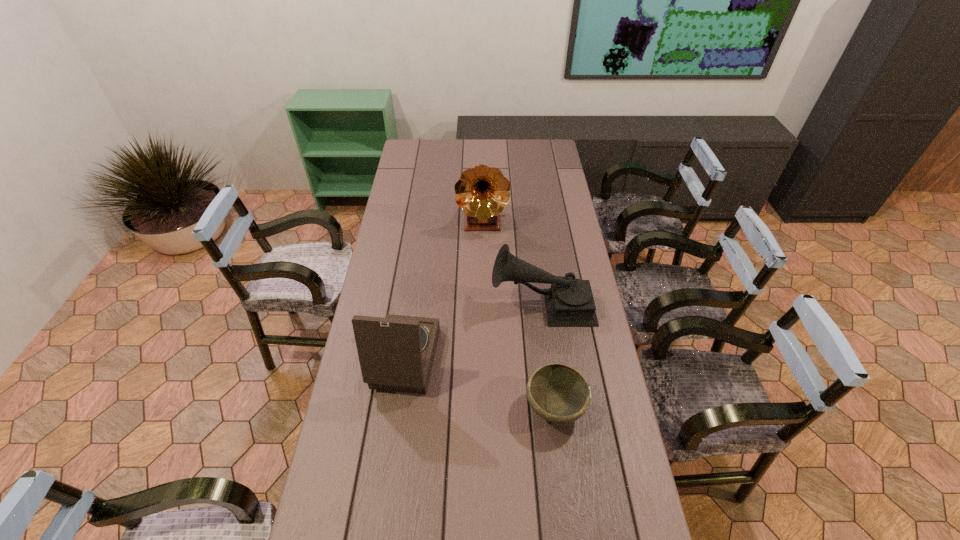
You are a GUI agent. You are given a task and a screenshot of the screen. Output one action in this format:
    pyautogui.click(x=<x>, y=<y>)
    Task: Click on the object positioned at the left edge
    This screenshot has height=540, width=960.
    Given the screenshot: What is the action you would take?
    pyautogui.click(x=396, y=353)

Find the location of a particular element. The image size is (960, 540). phonograph_record present at the right edge is located at coordinates (569, 302).

Where is `bowl positioned at the right edge`? This screenshot has width=960, height=540. bowl positioned at the right edge is located at coordinates (558, 393).

At what (x,y) coordinates should I click in order to perform the action: click on vacant position at the far edge of the desktop. Please return your answer as a coordinate pair (x, y). The height and width of the screenshot is (540, 960). Looking at the image, I should click on (502, 163).

The height and width of the screenshot is (540, 960). What are the coordinates of `vacant space at the left edge of the desktop` in the screenshot? It's located at (406, 211).

Find the location of a particular element. vacant space at the right edge of the desktop is located at coordinates coord(549,172).

Find the location of a particular element. The image size is (960, 540). vacant area that lies between the shortest object and the farthest phonograph_record is located at coordinates 518,315.

You are a GUI agent. You are given a task and a screenshot of the screen. Output one action in this format:
    pyautogui.click(x=<x>, y=<y>)
    Task: Click on the vacant point located between the second shortest object and the bowl
    
    Given the screenshot: What is the action you would take?
    pyautogui.click(x=548, y=356)

Identify the location of vacant area that lies between the bowl and the leftmost phonograph_record. (476, 384).

At what (x,y) coordinates should I click in order to perform the action: click on blank region between the leftmost phonograph_record and the farthest object. Please return your answer as a coordinate pair (x, y). Looking at the image, I should click on (440, 291).